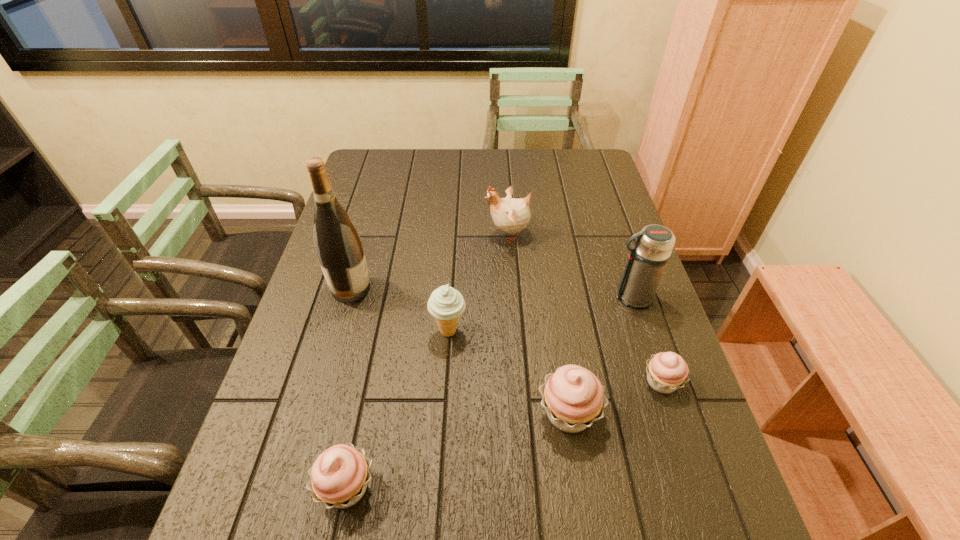
Identify the location of free region located 0.100m with a handle on the side of the second tallest object. (574, 298).

The width and height of the screenshot is (960, 540). What are the coordinates of `object that is at the near edge` in the screenshot? It's located at (339, 476).

In order to click on cupcake at the left edge in this screenshot , I will do `click(339, 476)`.

Locate an element on the screen. wine bottle that is at the left edge is located at coordinates (338, 246).

This screenshot has width=960, height=540. I want to click on cupcake that is at the right edge, so click(667, 371).

Image resolution: width=960 pixels, height=540 pixels. Identify the location of thermos bottle that is positioned at the right edge. (647, 260).

Where is `object that is positioned at the near left corner`? This screenshot has width=960, height=540. object that is positioned at the near left corner is located at coordinates (339, 476).

Find the location of `vacant space at the far edge`. vacant space at the far edge is located at coordinates (522, 183).

At what (x,y) coordinates should I click in order to perform the action: click on vacant position at the near edge of the desktop. Please return your answer as a coordinate pair (x, y). Looking at the image, I should click on (610, 484).

In the image, there is a desktop. Where is `vacant region at the left edge`? This screenshot has height=540, width=960. vacant region at the left edge is located at coordinates (317, 428).